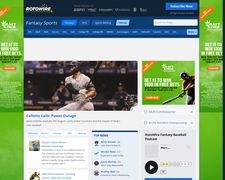
What are the coordinates of `pictures` in the screenshot? It's located at click(x=146, y=83), click(x=114, y=86), click(x=33, y=143), click(x=34, y=176), click(x=97, y=173), click(x=96, y=162), click(x=96, y=153), click(x=96, y=143).